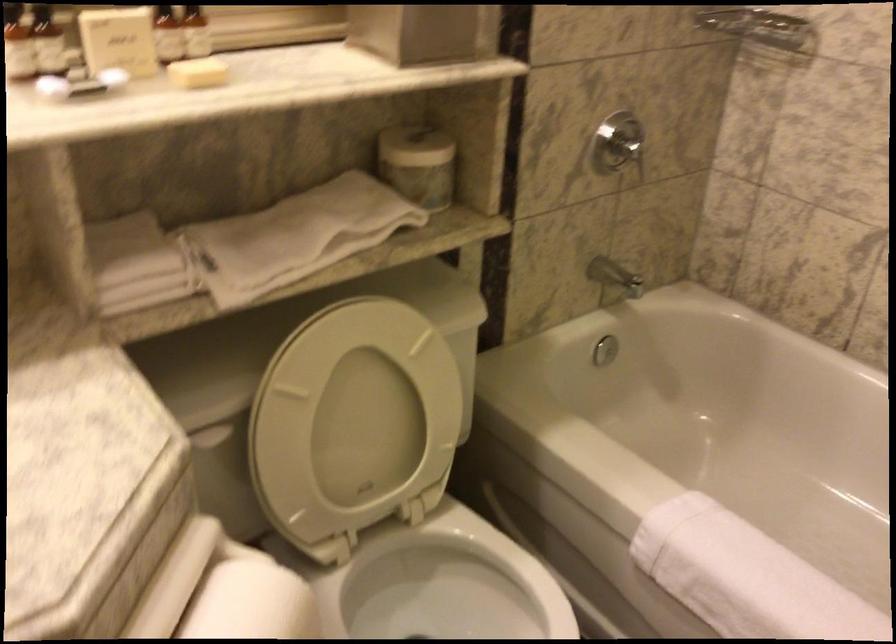
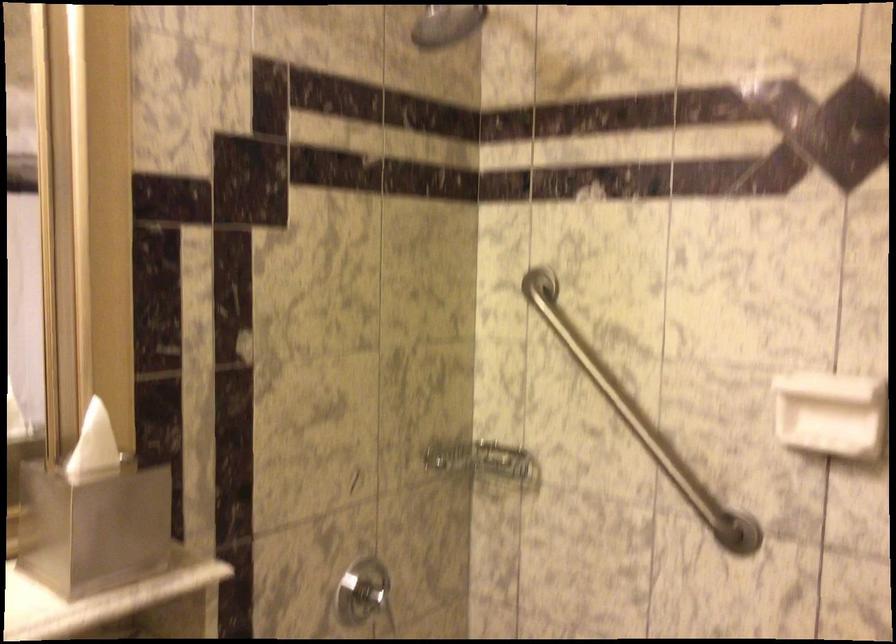
Question: In a continuous first-person perspective shot, in which direction is the camera moving?

Choices:
 (A) Left
 (B) Right
 (C) Forward
 (D) Backward

Answer: (B)